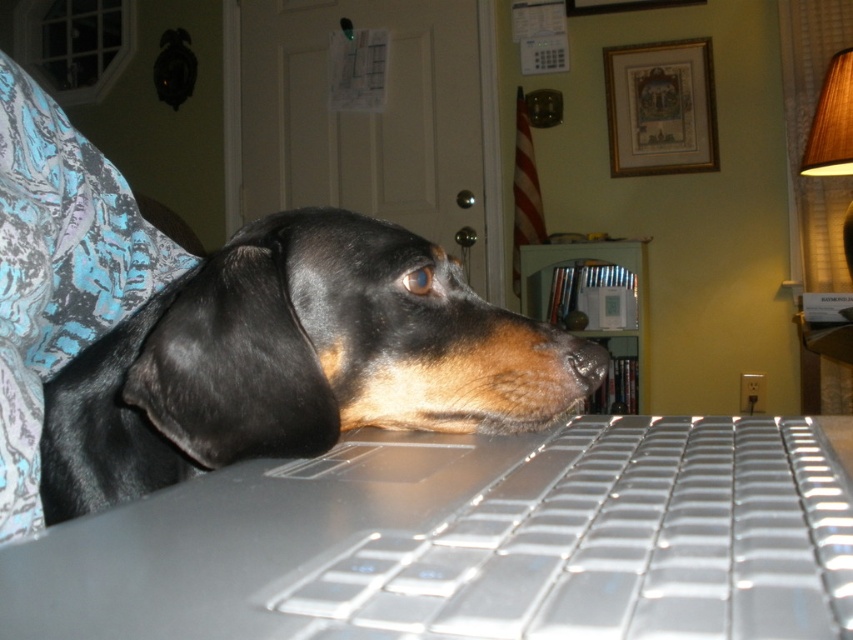
You are a photographer trying to capture the black shiny fur at center in the image. The camera you are using has a focus point at coordinate point (291, 362). Based on the scene description, where should you direct your camera to ensure the black shiny fur at center is in focus?

The point (291, 362) indicates the location of the black shiny fur at center, so directing the camera focus to this coordinate will ensure the black shiny fur at center is in focus.

You are taking a photo of the scene and want to focus on both point (665, 609) and point (581, 352). Which point should you adjust your focus to prioritize for a clearer image?

Point (665, 609) is closer to the camera than point (581, 352), so you should prioritize focusing on point (665, 609) for a clearer image.

Consider the image. You are a photographer trying to capture the dog in the scene. You want to ensure that both the black shiny fur at center and the brown matte nose at center are visible in your shot. Based on their positions, which object should you focus on first to frame them properly?

The black shiny fur at center is to the left of the brown matte nose at center, so you should focus on the black shiny fur at center first to ensure both are in frame.